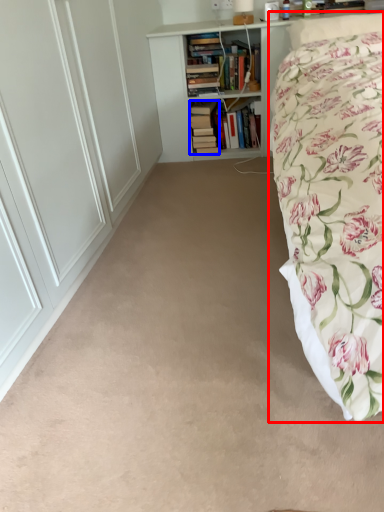
Question: Which object is closer to the camera taking this photo, bed (highlighted by a red box) or book (highlighted by a blue box)?

Choices:
 (A) bed
 (B) book

Answer: (A)